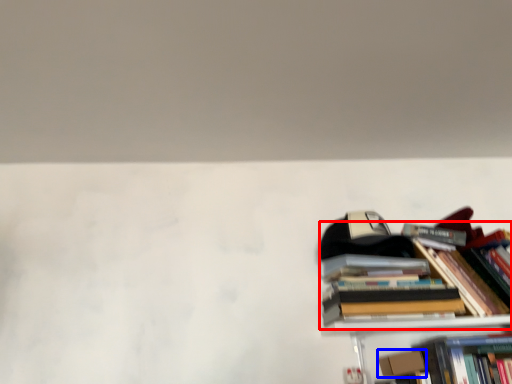
Question: Among these objects, which one is farthest to the camera, book (highlighted by a red box) or paperback book (highlighted by a blue box)?

Choices:
 (A) book
 (B) paperback book

Answer: (B)